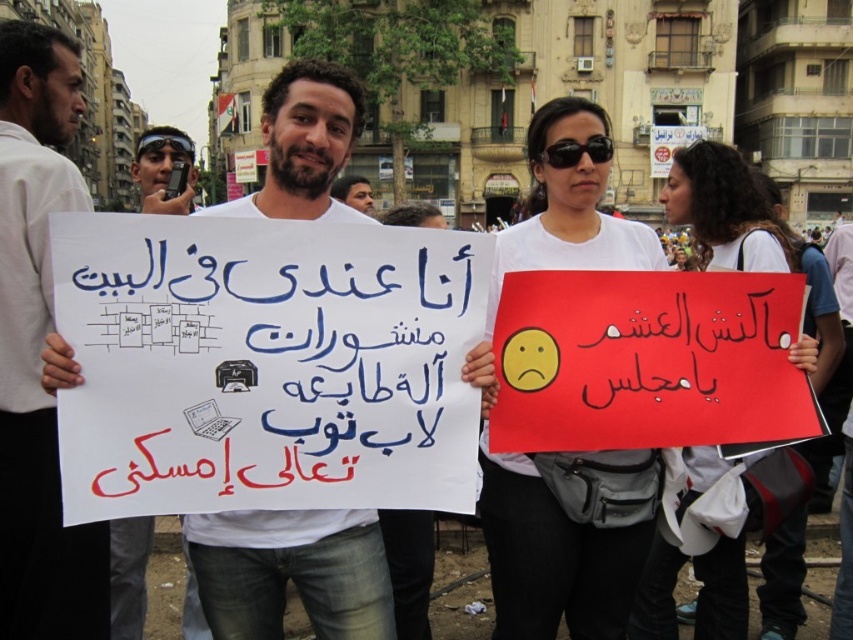
You are a photographer standing at the center of the protest area. You want to take a photo that includes both the white paper sign at center and the black paper at center. Given that your camera has a maximum focus range of 8 meters, will you be able to capture both objects in focus?

The white paper sign at center is 8.14 meters away from the black paper at center. Since the distance between them exceeds the camera maximum focus range of 8 meters, you cannot capture both objects in focus simultaneously.

You are a photographer trying to capture both the white paper at center and the black paper at center in a single frame. Given that your camera can only accommodate objects up to the size of the larger one, will both fit without cropping?

The white paper at center is wider than the black paper at center. Since the camera can accommodate up to the size of the larger object, which is the white paper at center, both papers will fit without cropping as the black paper at center is smaller in width.

You are a photographer trying to capture a clear image of both the white paper sign at center and the black plastic sunglasses at center. Since you want both objects in focus, which one should you adjust your camera focus on first?

The white paper sign at center is closer to the viewer than the black plastic sunglasses at center. To ensure both are in focus, you should focus on the white paper sign at center first, as it is the closer object.